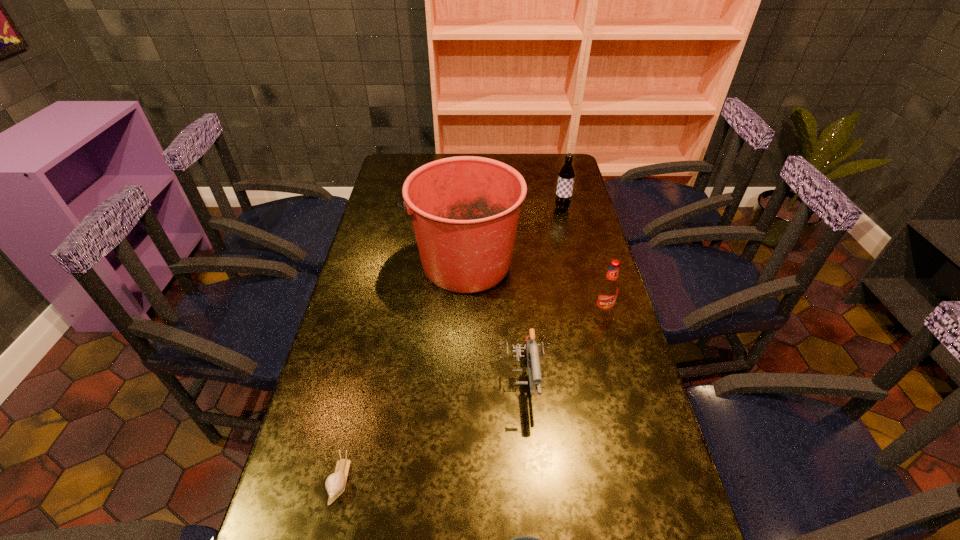
The height and width of the screenshot is (540, 960). Identify the location of vacant space located 0.120m on the back of the nearer root beer. tap(593, 279).

Locate an element on the screen. Image resolution: width=960 pixels, height=540 pixels. blank area located 0.090m at the barrel end of the fourth farthest object is located at coordinates (529, 448).

This screenshot has width=960, height=540. Identify the location of object located at the left edge. (335, 483).

In the image, there is a desktop. Identify the location of free space at the far edge. This screenshot has height=540, width=960. (483, 154).

This screenshot has height=540, width=960. I want to click on vacant area at the left edge, so click(x=399, y=280).

In the image, there is a desktop. Where is `vacant space at the right edge`? The height and width of the screenshot is (540, 960). vacant space at the right edge is located at coordinates (562, 278).

Where is `vacant area at the far right corner`? vacant area at the far right corner is located at coordinates (560, 159).

Where is `vacant space in between the nearer root beer and the second nearest object`? The width and height of the screenshot is (960, 540). vacant space in between the nearer root beer and the second nearest object is located at coordinates (471, 396).

Find the location of a particular element. This screenshot has width=960, height=540. empty space that is in between the tallest object and the nearer root beer is located at coordinates (534, 288).

The image size is (960, 540). I want to click on vacant space that is in between the bucket and the second nearest object, so click(x=402, y=372).